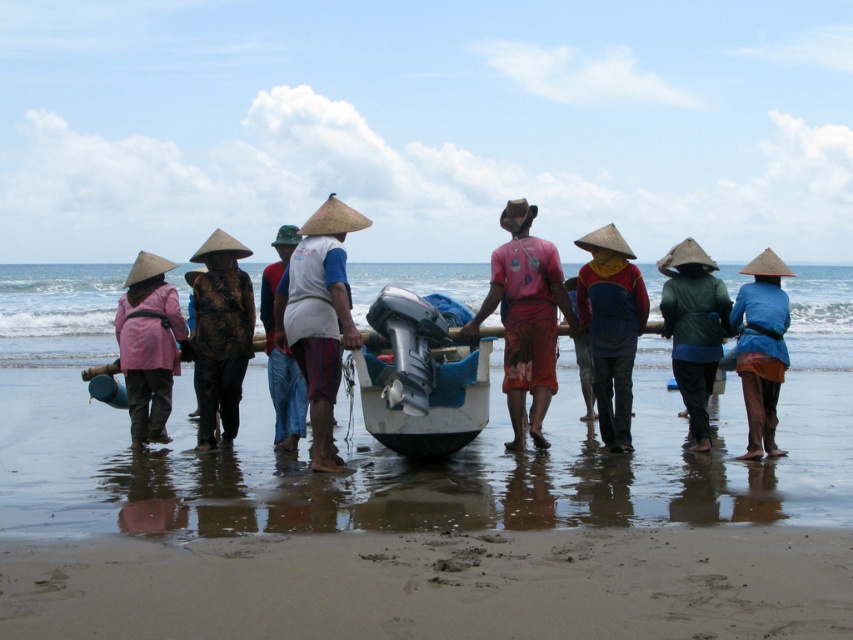
Question: Can you confirm if matte pink jacket at left is positioned above white fabric shirt at center?

Choices:
 (A) no
 (B) yes

Answer: (B)

Question: Among these objects, which one is farthest from the camera?

Choices:
 (A) white cotton shirt at center
 (B) white plastic boat at center

Answer: (A)

Question: Which of the following is the closest to the observer?

Choices:
 (A) (196, 291)
 (B) (612, 401)

Answer: (A)

Question: Which object appears closest to the camera in this image?

Choices:
 (A) textured brown jacket at center
 (B) white cotton shirt at center
 (C) white plastic boat at center
 (D) clear blue water at center

Answer: (C)

Question: From the image, what is the correct spatial relationship of white plastic boat at center in relation to white cotton shirt at center?

Choices:
 (A) left
 (B) right

Answer: (B)

Question: Does matte pink shirt at center have a lesser width compared to blue denim pants at center?

Choices:
 (A) no
 (B) yes

Answer: (A)